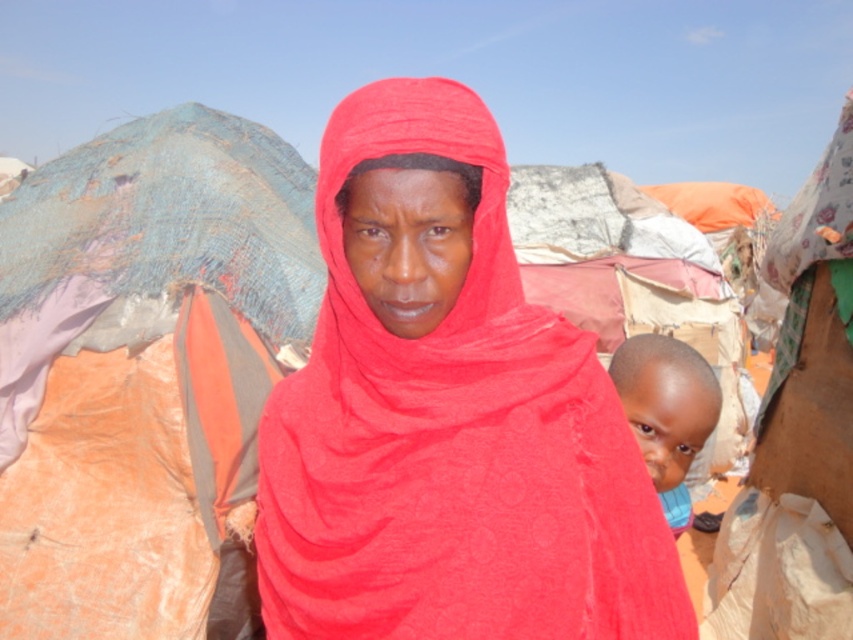
Is matte red scarf at center shorter than blue fabric at right?

No.

Who is more distant from viewer, (293, 433) or (671, 444)?

Positioned behind is point (671, 444).

Which is in front, point (555, 525) or point (697, 436)?

Point (555, 525)

This screenshot has width=853, height=640. What are the coordinates of `matte red scarf at center` in the screenshot? It's located at (447, 416).